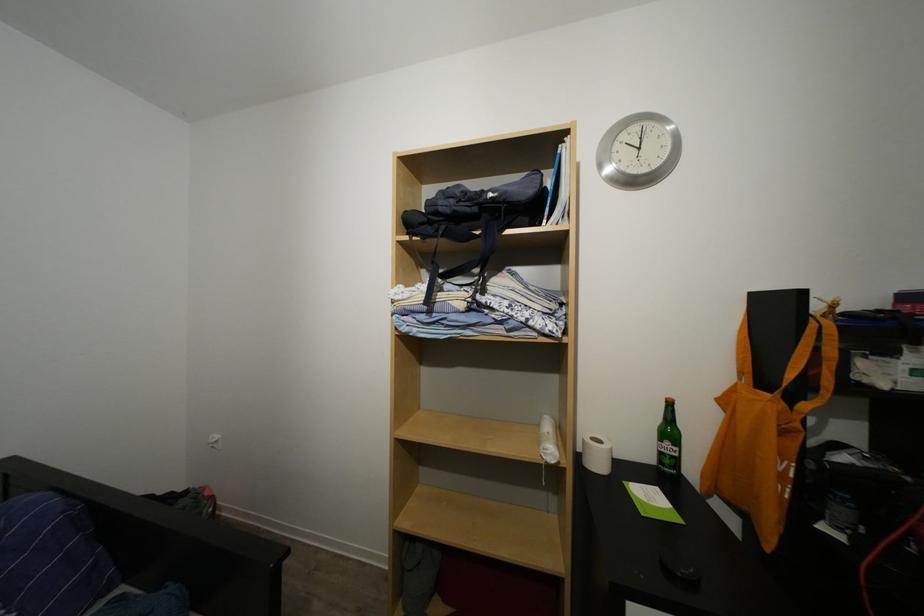
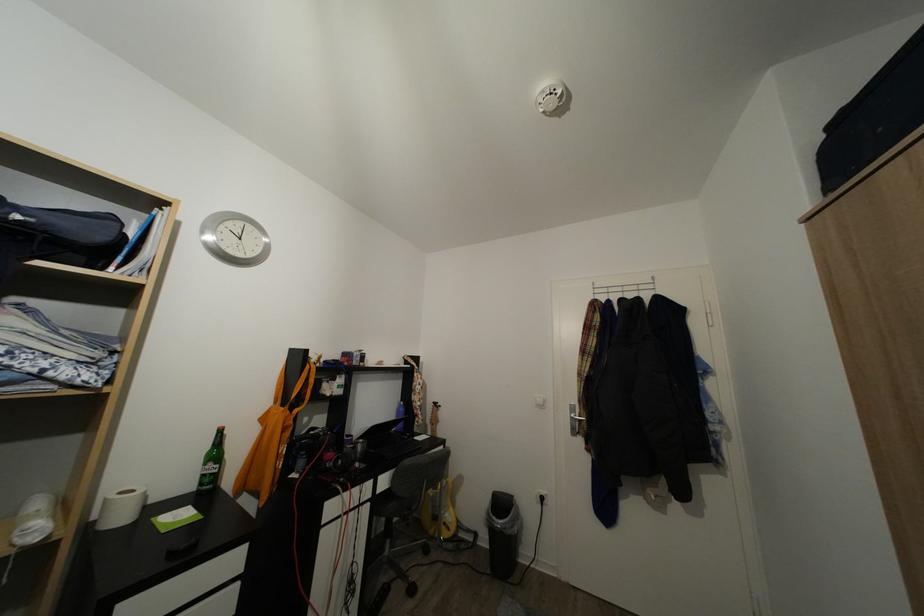
In the second image, find the point that corresponds to point 675,450 in the first image.

(217, 471)